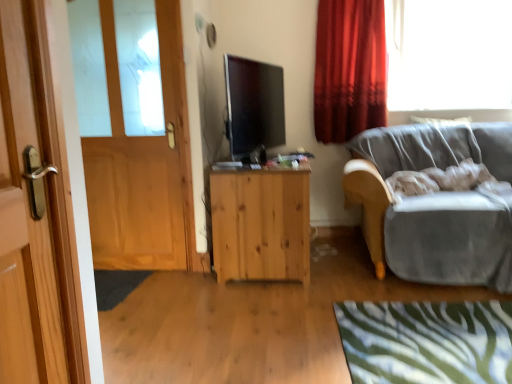
Question: Does green zebra-patterned rug at lower right have a smaller size compared to transparent glass window at upper right?

Choices:
 (A) no
 (B) yes

Answer: (B)

Question: Is green zebra-patterned rug at lower right behind transparent glass window at upper right?

Choices:
 (A) yes
 (B) no

Answer: (B)

Question: Are green zebra-patterned rug at lower right and transparent glass window at upper right beside each other?

Choices:
 (A) yes
 (B) no

Answer: (B)

Question: From a real-world perspective, is green zebra-patterned rug at lower right located higher than transparent glass window at upper right?

Choices:
 (A) no
 (B) yes

Answer: (A)

Question: Is green zebra-patterned rug at lower right outside transparent glass window at upper right?

Choices:
 (A) yes
 (B) no

Answer: (A)

Question: Does green zebra-patterned rug at lower right have a lesser height compared to transparent glass window at upper right?

Choices:
 (A) yes
 (B) no

Answer: (A)

Question: Can you confirm if wooden door at left, arranged as the first door when viewed from the right, is smaller than matte black tv at center?

Choices:
 (A) yes
 (B) no

Answer: (A)

Question: Does wooden door at left, the 2th door from the back, touch matte black tv at center?

Choices:
 (A) no
 (B) yes

Answer: (A)

Question: Is wooden door at left, arranged as the 1th door when viewed from the front, located outside matte black tv at center?

Choices:
 (A) yes
 (B) no

Answer: (A)

Question: Is there a large distance between wooden door at left, arranged as the first door when viewed from the right, and matte black tv at center?

Choices:
 (A) yes
 (B) no

Answer: (A)

Question: Is wooden door at left, arranged as the 1th door when viewed from the front, closer to the viewer compared to matte black tv at center?

Choices:
 (A) no
 (B) yes

Answer: (B)

Question: Can you confirm if wooden door at left, arranged as the first door when viewed from the right, is shorter than matte black tv at center?

Choices:
 (A) no
 (B) yes

Answer: (A)

Question: Is transparent glass window at upper right positioned beyond the bounds of velvet gray couch at right?

Choices:
 (A) no
 (B) yes

Answer: (B)